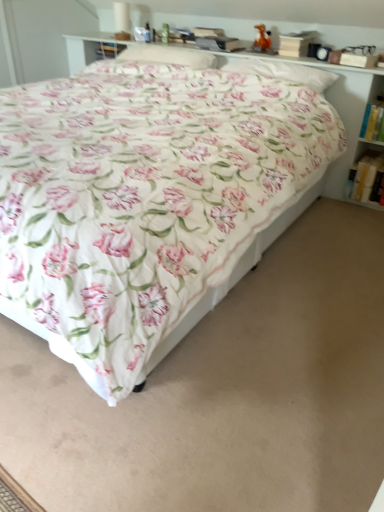
Question: Does point (137, 54) appear closer or farther from the camera than point (362, 157)?

Choices:
 (A) closer
 (B) farther

Answer: (B)

Question: Is white soft pillow at upper center, the 2th pillow positioned from the right, bigger or smaller than white paper book at right, placed as the second book when sorted from top to bottom?

Choices:
 (A) big
 (B) small

Answer: (A)

Question: Which object is the farthest from the white soft pillow at upper center, the 2th pillow positioned from the right?

Choices:
 (A) floral fabric pillow at upper center, arranged as the second pillow when viewed from the left
 (B) white paper book at right, the 1th book positioned from the top
 (C) floral cotton bed at center
 (D) white paper book at right, placed as the second book when sorted from top to bottom

Answer: (D)

Question: Which is farther from the white paper book at right, the 1th book positioned from the top?

Choices:
 (A) white paper book at right, placed as the second book when sorted from top to bottom
 (B) white soft pillow at upper center, the 2th pillow positioned from the right
 (C) floral cotton bed at center
 (D) floral fabric pillow at upper center, the first pillow in the right-to-left sequence

Answer: (C)